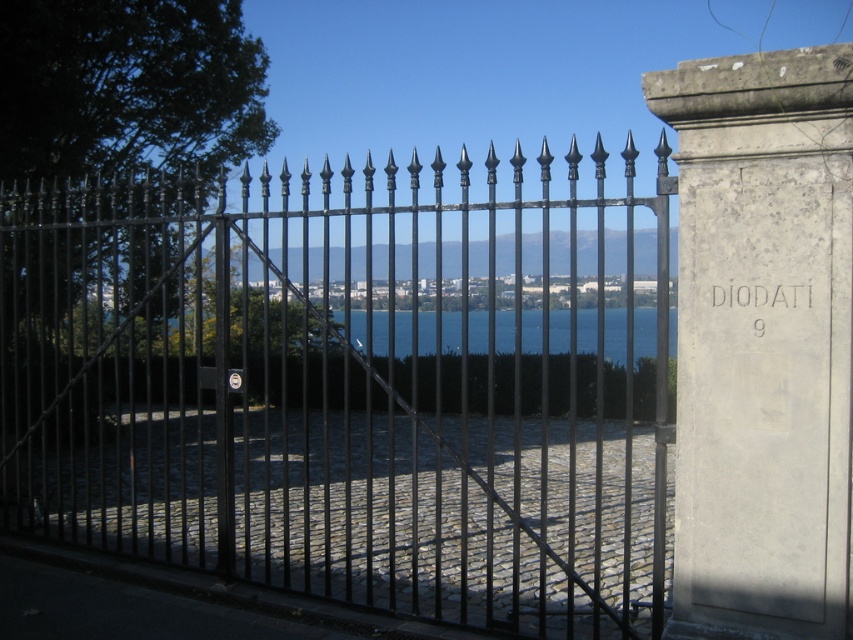
Does black wrought iron fence at center have a smaller size compared to blue glass water at center?

No.

Identify the location of black wrought iron fence at center. This screenshot has width=853, height=640. click(347, 387).